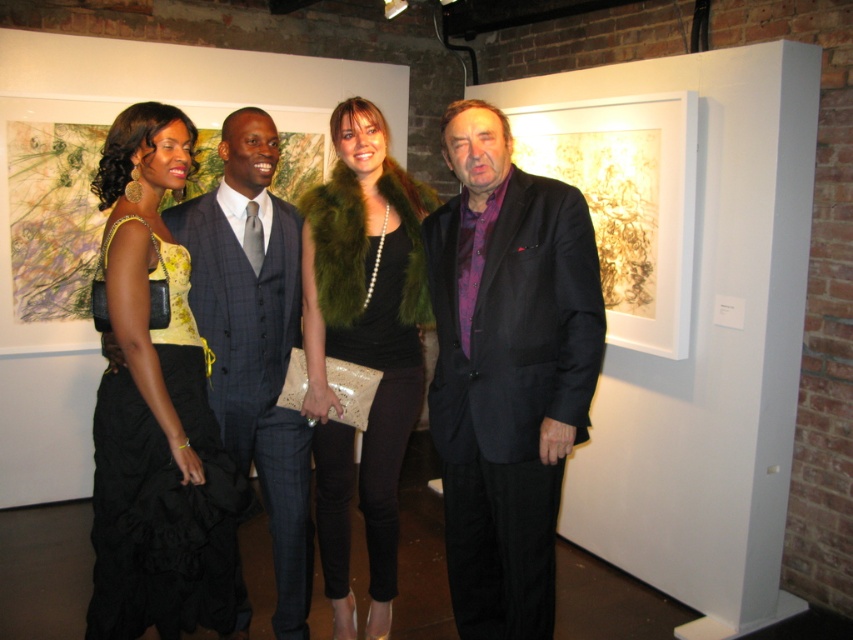
Does matte black suit at center have a greater width compared to plaid wool business suit at center?

Correct, the width of matte black suit at center exceeds that of plaid wool business suit at center.

Between matte black suit at center and plaid wool business suit at center, which one has more height?

matte black suit at center is taller.

Where is `matte black suit at center`? Image resolution: width=853 pixels, height=640 pixels. matte black suit at center is located at coordinates (508, 371).

Does point (135, 237) lie behind point (250, 340)?

That is False.

Between black satin dress at left and plaid wool business suit at center, which one has more height?

Standing taller between the two is black satin dress at left.

Between point (122, 620) and point (233, 225), which one is positioned in front?

Positioned in front is point (122, 620).

What are the coordinates of `black satin dress at left` in the screenshot? It's located at [155, 412].

Which is behind, point (117, 461) or point (370, 298)?

Point (370, 298)

Does black satin dress at left appear on the right side of green fur vest at center?

In fact, black satin dress at left is to the left of green fur vest at center.

Who is more forward, (x=144, y=538) or (x=345, y=182)?

Point (x=144, y=538) is in front.

Where is `black satin dress at left`? The height and width of the screenshot is (640, 853). black satin dress at left is located at coordinates (155, 412).